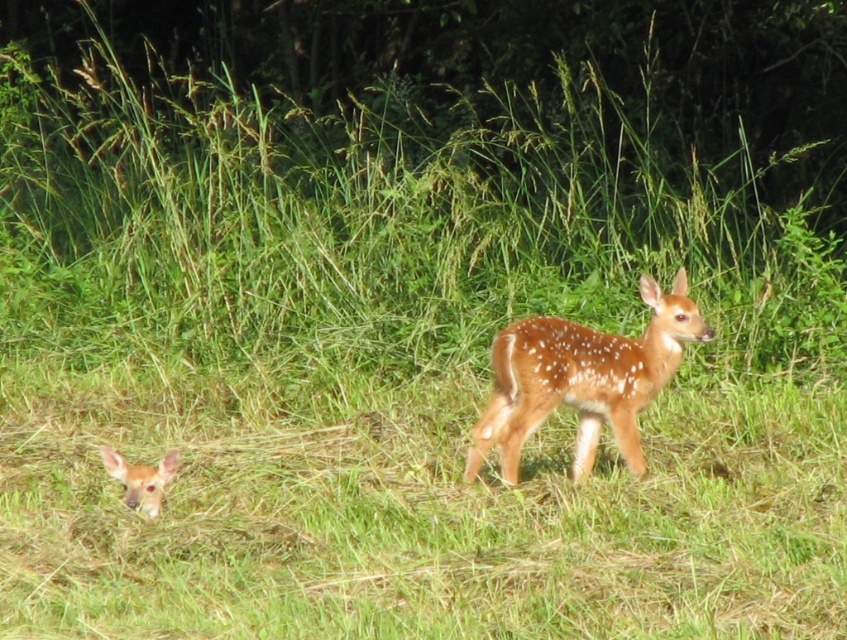
Question: In this image, where is spotted fur deer at center located relative to spotted fur deer at lower left?

Choices:
 (A) right
 (B) left

Answer: (A)

Question: Which point appears farthest from the camera in this image?

Choices:
 (A) click(x=580, y=428)
 (B) click(x=147, y=493)

Answer: (A)

Question: Which object is closer to the camera taking this photo?

Choices:
 (A) spotted fur deer at lower left
 (B) spotted fur deer at center

Answer: (B)

Question: Considering the relative positions of spotted fur deer at center and spotted fur deer at lower left in the image provided, where is spotted fur deer at center located with respect to spotted fur deer at lower left?

Choices:
 (A) left
 (B) right

Answer: (B)

Question: Can you confirm if spotted fur deer at center is thinner than spotted fur deer at lower left?

Choices:
 (A) no
 (B) yes

Answer: (A)